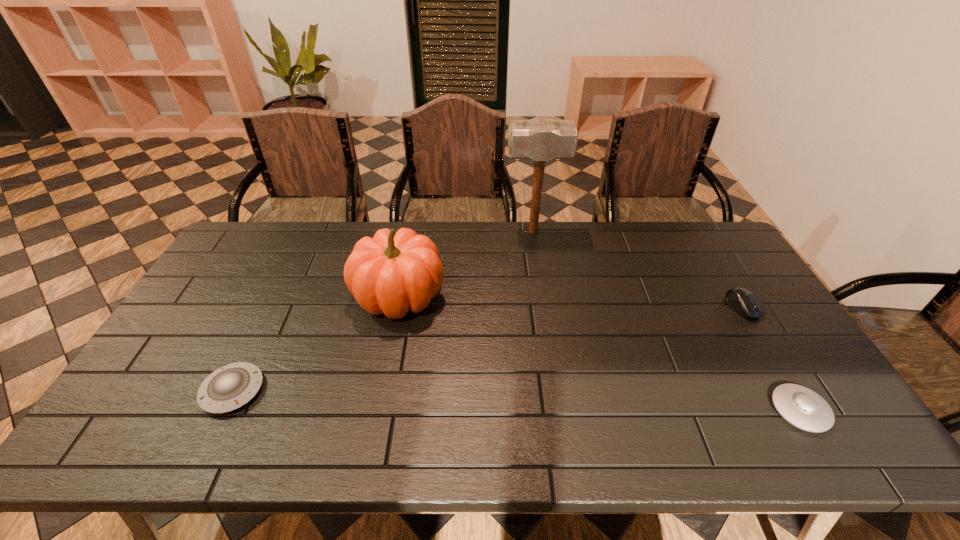
Locate an element on the screen. mallet is located at coordinates (541, 140).

The width and height of the screenshot is (960, 540). Find the location of `the third object from right to left`. the third object from right to left is located at coordinates (541, 140).

The height and width of the screenshot is (540, 960). I want to click on the fourth shortest object, so click(x=391, y=273).

Image resolution: width=960 pixels, height=540 pixels. In order to click on pumpkin in this screenshot , I will do `click(391, 273)`.

At what (x,y) coordinates should I click in order to perform the action: click on mouse. Please return your answer as a coordinate pair (x, y). Looking at the image, I should click on point(744,302).

Find the location of a particular element. This screenshot has height=540, width=960. the right saucer is located at coordinates (800, 406).

You are a GUI agent. You are given a task and a screenshot of the screen. Output one action in this format:
    pyautogui.click(x=<x>, y=<y>)
    Task: Click on the leftmost object
    This screenshot has height=540, width=960.
    Given the screenshot: What is the action you would take?
    pyautogui.click(x=228, y=388)

The image size is (960, 540). Identify the location of free space located 0.350m on the striking face of the tallest object. (409, 232).

At what (x,y) coordinates should I click in order to perform the action: click on free point located on the striking face of the tallest object. Please return your answer as a coordinate pair (x, y). This screenshot has width=960, height=540. Looking at the image, I should click on (447, 232).

Where is `vacant space situated on the striking face of the tallest object`? vacant space situated on the striking face of the tallest object is located at coordinates (450, 232).